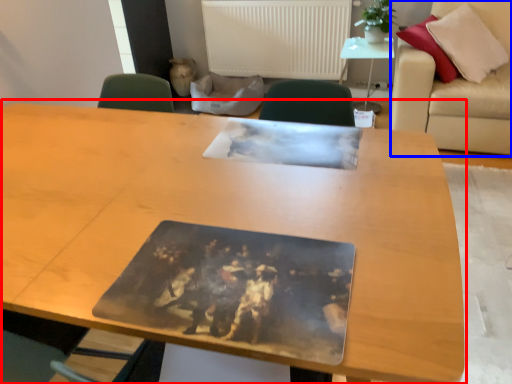
Question: Which of the following is the farthest to the observer, table (highlighted by a red box) or couch (highlighted by a blue box)?

Choices:
 (A) table
 (B) couch

Answer: (B)